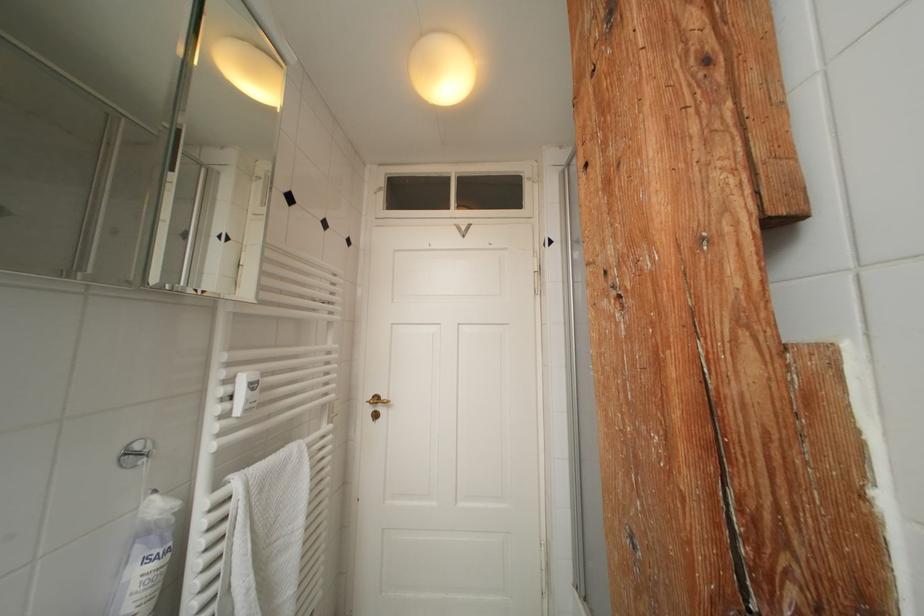
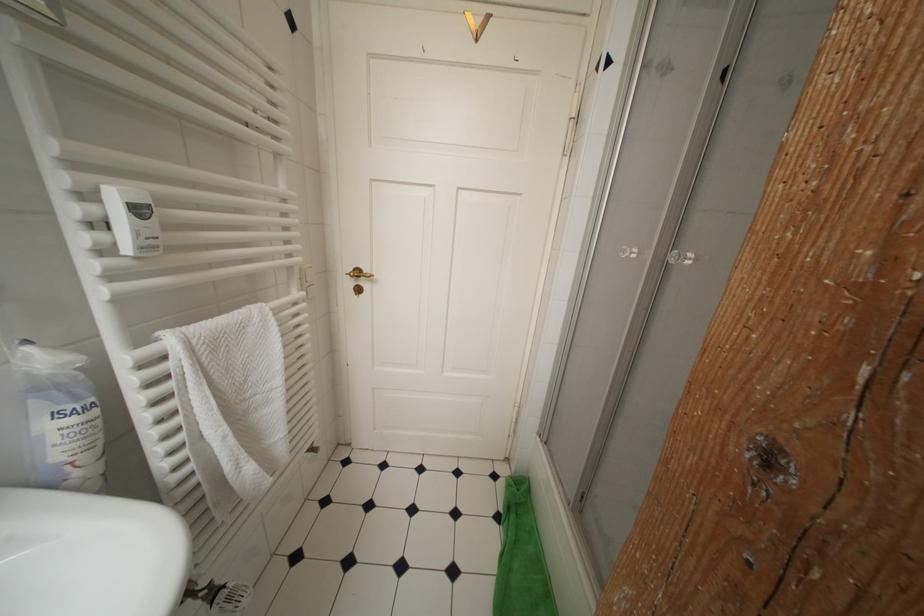
Question: The first image is from the beginning of the video and the second image is from the end. How did the camera likely rotate when shooting the video?

Choices:
 (A) Left
 (B) Right
 (C) Up
 (D) Down

Answer: (D)